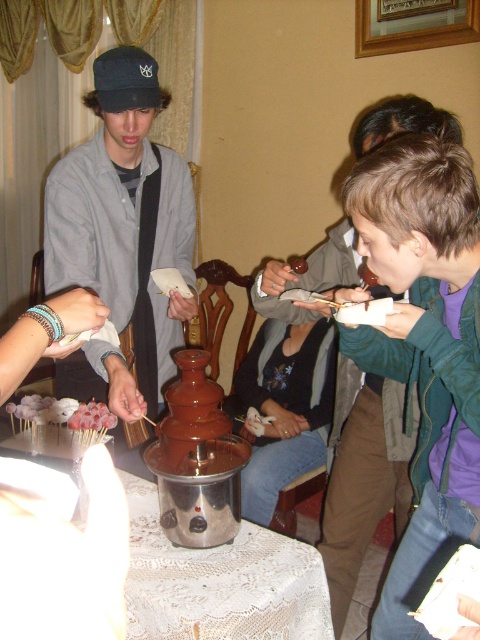
Identify the location of green matte jacket at upper right. This screenshot has width=480, height=640. (423, 346).

Who is positioned more to the left, green matte jacket at upper right or white sugary skewers at lower left?

white sugary skewers at lower left

Where is `green matte jacket at upper right`? The height and width of the screenshot is (640, 480). green matte jacket at upper right is located at coordinates (423, 346).

Is green matte jacket at upper right above matte black cap at center?

No.

Who is higher up, green matte jacket at upper right or matte black cap at center?

matte black cap at center is higher up.

You are a GUI agent. You are given a task and a screenshot of the screen. Output one action in this format:
    pyautogui.click(x=<x>, y=<y>)
    Task: Click on the green matte jacket at upper right
    
    Given the screenshot: What is the action you would take?
    pyautogui.click(x=423, y=346)

Where is `green matte jacket at upper right`? The width and height of the screenshot is (480, 640). green matte jacket at upper right is located at coordinates (423, 346).

The width and height of the screenshot is (480, 640). What do you see at coordinates (122, 243) in the screenshot?
I see `matte black cap at center` at bounding box center [122, 243].

Between point (121, 100) and point (69, 406), which one is positioned in front?

Point (121, 100) is more forward.

Who is more distant from viewer, [45,218] or [29,413]?

The point [29,413] is behind.

This screenshot has width=480, height=640. What are the coordinates of `matte black cap at center` in the screenshot? It's located at (122, 243).